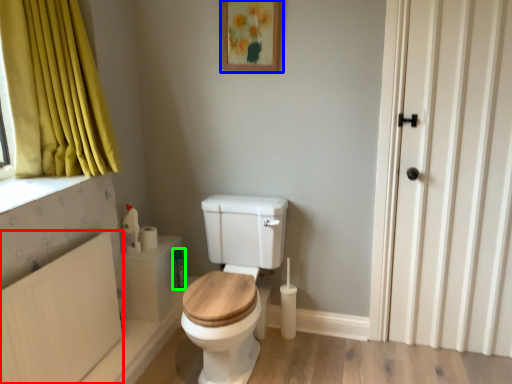
Question: Which object is positioned closest to radiator (highlighted by a red box)? Select from picture frame (highlighted by a blue box) and toiletry (highlighted by a green box).

Choices:
 (A) picture frame
 (B) toiletry

Answer: (B)